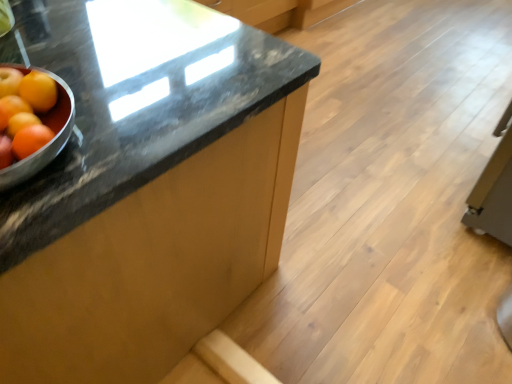
Question: Is orange matte at left turned away from orange matte at left?

Choices:
 (A) no
 (B) yes

Answer: (A)

Question: Is the position of orange matte at left less distant than that of orange matte at left?

Choices:
 (A) yes
 (B) no

Answer: (A)

Question: From the image's perspective, is orange matte at left over orange matte at left?

Choices:
 (A) no
 (B) yes

Answer: (A)

Question: Can you confirm if orange matte at left is positioned to the right of orange matte at left?

Choices:
 (A) no
 (B) yes

Answer: (A)

Question: Is orange matte at left bigger than orange matte at left?

Choices:
 (A) no
 (B) yes

Answer: (A)

Question: From a real-world perspective, is orange matte grapefruit at left positioned above or below orange matte at left?

Choices:
 (A) below
 (B) above

Answer: (B)

Question: Which is correct: orange matte grapefruit at left is inside orange matte at left, or outside of it?

Choices:
 (A) outside
 (B) inside

Answer: (A)

Question: Considering the positions of orange matte grapefruit at left and orange matte at left in the image, is orange matte grapefruit at left taller or shorter than orange matte at left?

Choices:
 (A) short
 (B) tall

Answer: (A)

Question: Is orange matte grapefruit at left wider or thinner than orange matte at left?

Choices:
 (A) thin
 (B) wide

Answer: (A)

Question: In the image, is orange matte at left positioned in front of or behind orange matte at left?

Choices:
 (A) behind
 (B) front

Answer: (A)

Question: Is orange matte at left bigger or smaller than orange matte at left?

Choices:
 (A) big
 (B) small

Answer: (A)

Question: From a real-world perspective, is orange matte at left physically located above or below orange matte at left?

Choices:
 (A) above
 (B) below

Answer: (A)

Question: Based on their positions, is orange matte at left located to the left or right of orange matte at left?

Choices:
 (A) left
 (B) right

Answer: (B)

Question: Would you say orange matte at left is to the left or to the right of orange matte grapefruit at left in the picture?

Choices:
 (A) left
 (B) right

Answer: (A)

Question: From the image's perspective, is orange matte at left above or below orange matte grapefruit at left?

Choices:
 (A) below
 (B) above

Answer: (B)